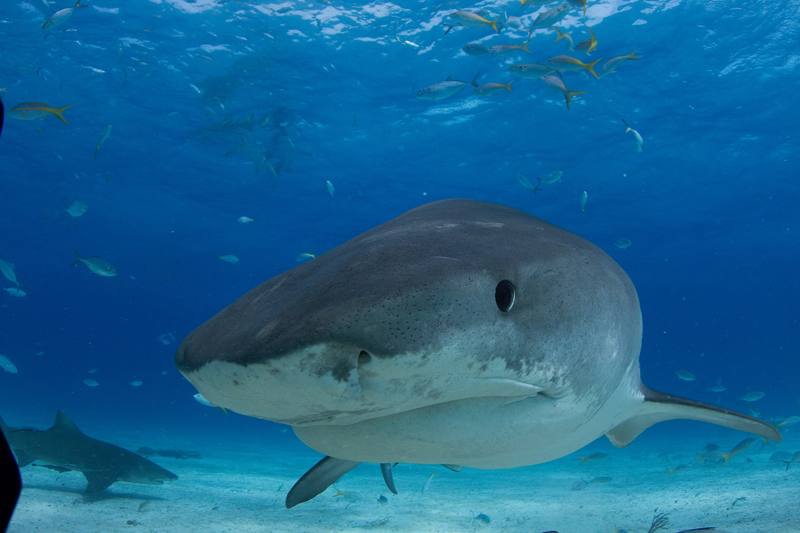
Identify the location of floor. The height and width of the screenshot is (533, 800). (264, 514).